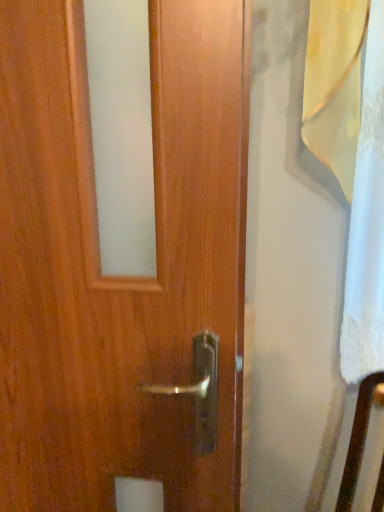
What do you see at coordinates (119, 278) in the screenshot? I see `wooden door at center` at bounding box center [119, 278].

Identify the location of wooden door at center. The image size is (384, 512). (119, 278).

The width and height of the screenshot is (384, 512). What are the coordinates of `wooden door at center` in the screenshot? It's located at (119, 278).